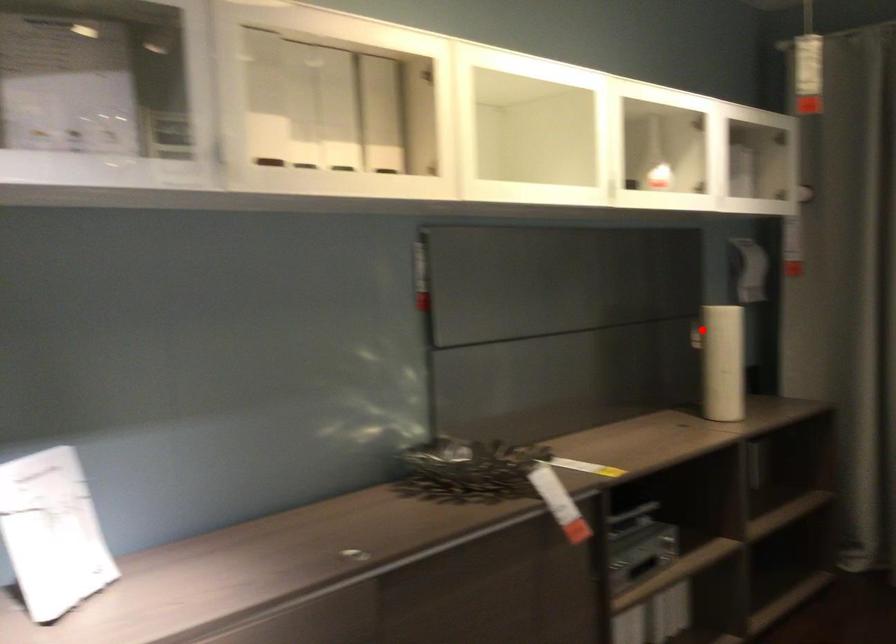
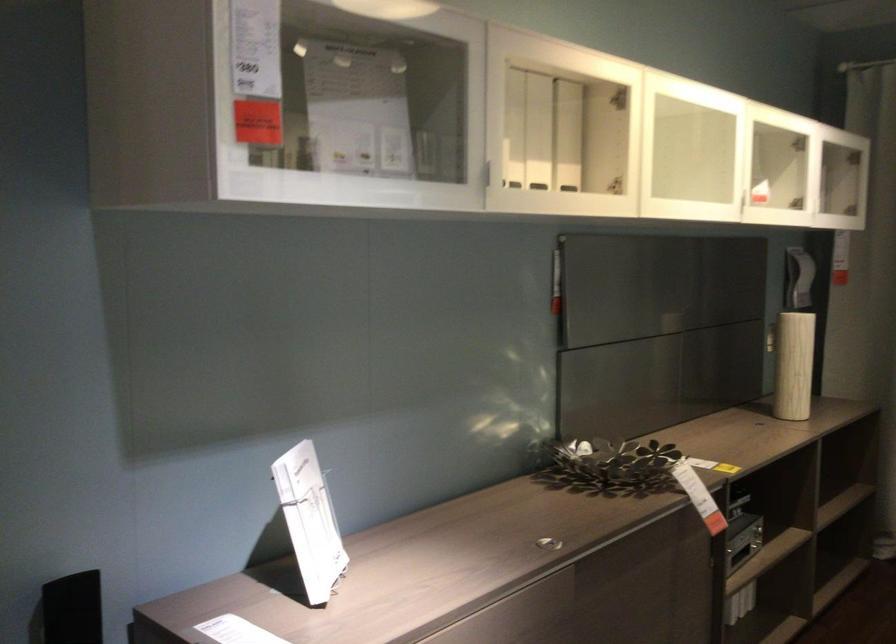
Locate, in the second image, the point that corresponds to the highlighted location in the first image.

(770, 339)